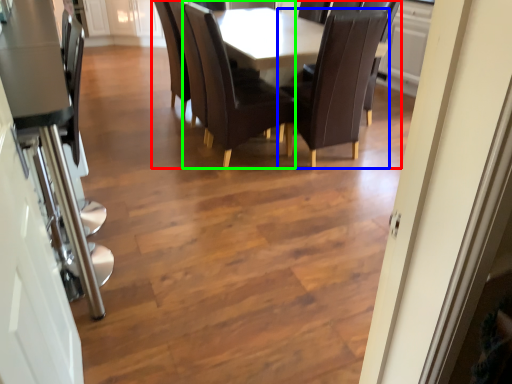
Question: Which object is positioned farthest from kitchen & dining room table (highlighted by a red box)? Select from chair (highlighted by a blue box) and chair (highlighted by a green box).

Choices:
 (A) chair
 (B) chair

Answer: (A)